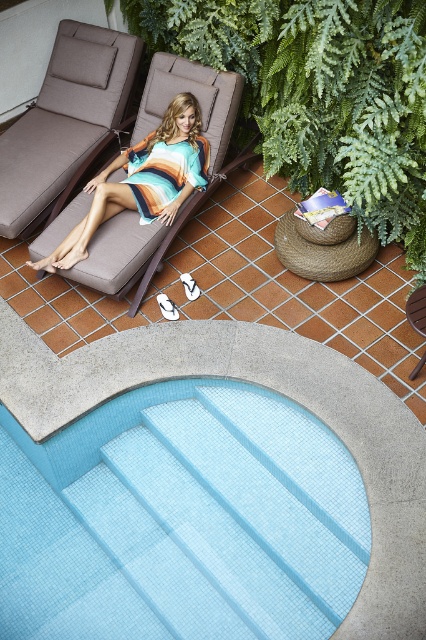
Can you confirm if light blue tile swimming pool at lower center is positioned to the right of striped cotton dress at center?

Yes, light blue tile swimming pool at lower center is to the right of striped cotton dress at center.

Is light blue tile swimming pool at lower center to the left of striped cotton dress at center from the viewer's perspective?

No, light blue tile swimming pool at lower center is not to the left of striped cotton dress at center.

Is point (348, 461) less distant than point (187, 106)?

Yes.

Locate an element on the screen. The height and width of the screenshot is (640, 426). light blue tile swimming pool at lower center is located at coordinates (181, 520).

Does green leafy plant at upper center appear on the right side of striped cotton dress at center?

Yes, green leafy plant at upper center is to the right of striped cotton dress at center.

Identify the location of green leafy plant at upper center. (321, 93).

Does matte brown chaise lounge at upper left have a greater width compared to striped cotton dress at center?

No.

Which of these two, matte brown chaise lounge at upper left or striped cotton dress at center, stands taller?

matte brown chaise lounge at upper left is taller.

Find the location of a particular element. matte brown chaise lounge at upper left is located at coordinates (65, 120).

Find the location of `matte brown chaise lounge at upper left`. matte brown chaise lounge at upper left is located at coordinates (65, 120).